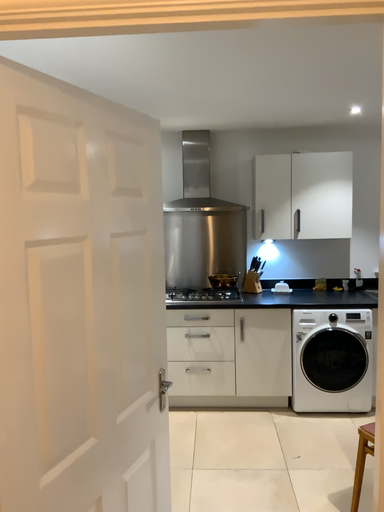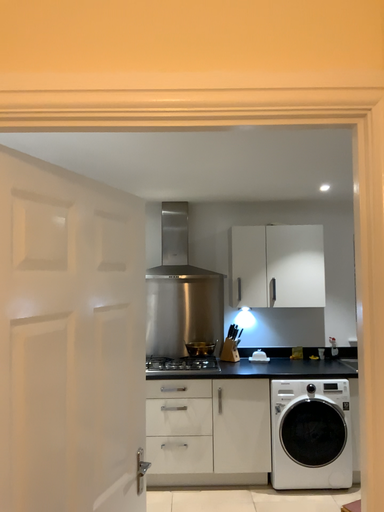
Question: How did the camera likely rotate when shooting the video?

Choices:
 (A) rotated downward
 (B) rotated upward

Answer: (B)